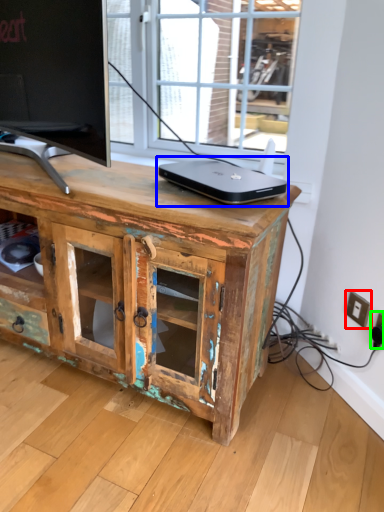
Question: Considering the real-world distances, which object is farthest from electric outlet (highlighted by a red box)? laptop (highlighted by a blue box) or electric outlet (highlighted by a green box)?

Choices:
 (A) laptop
 (B) electric outlet

Answer: (A)